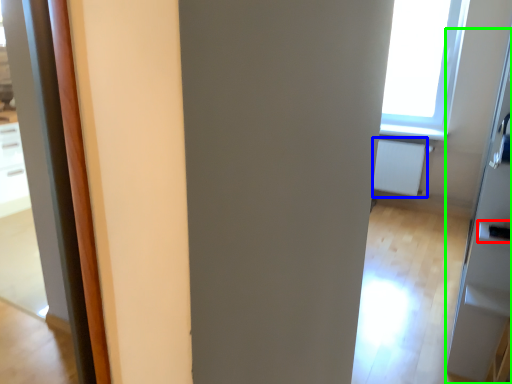
Question: Estimate the real-world distances between objects in this image. Which object is farther from door handle (highlighted by a red box), radiator (highlighted by a blue box) or screen door (highlighted by a green box)?

Choices:
 (A) radiator
 (B) screen door

Answer: (A)